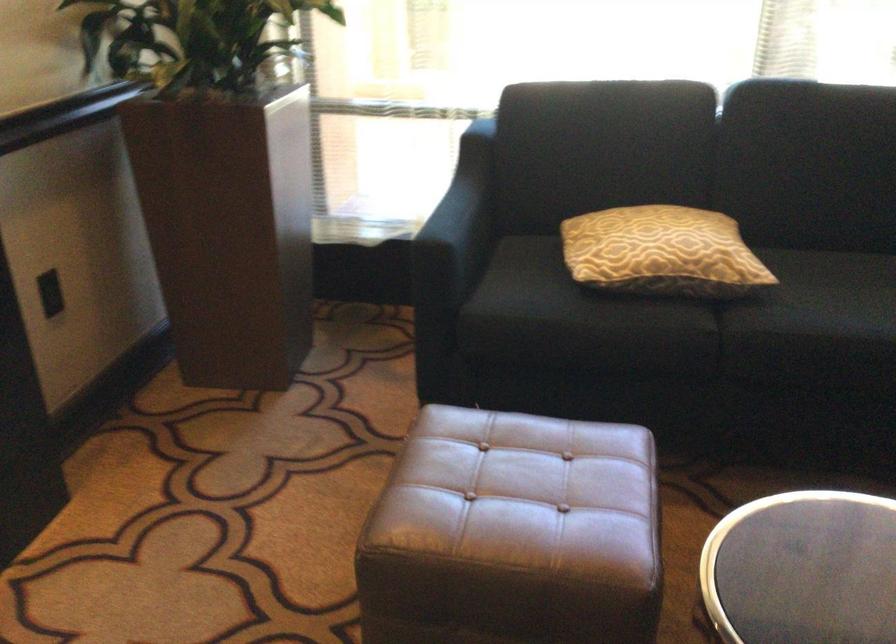
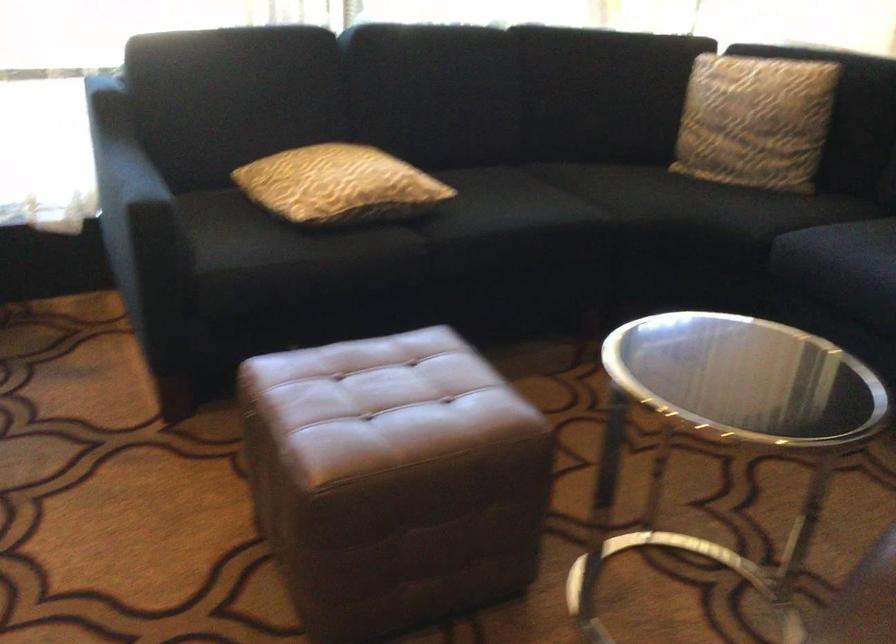
Locate, in the second image, the point that corresponds to pixel 640 249 in the first image.

(339, 185)